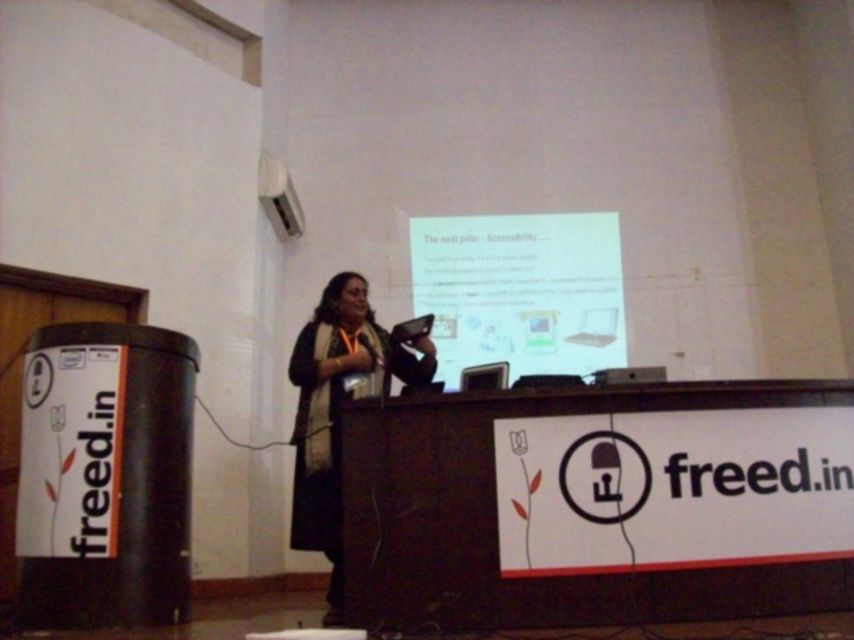
Where is `white glossy projector screen at upper center`? white glossy projector screen at upper center is located at coordinates (519, 291).

Does white glossy projector screen at upper center have a lesser width compared to black fabric at center?

In fact, white glossy projector screen at upper center might be wider than black fabric at center.

Is point (566, 291) closer to viewer compared to point (346, 301)?

That is False.

Where is `white glossy projector screen at upper center`? The width and height of the screenshot is (854, 640). white glossy projector screen at upper center is located at coordinates (519, 291).